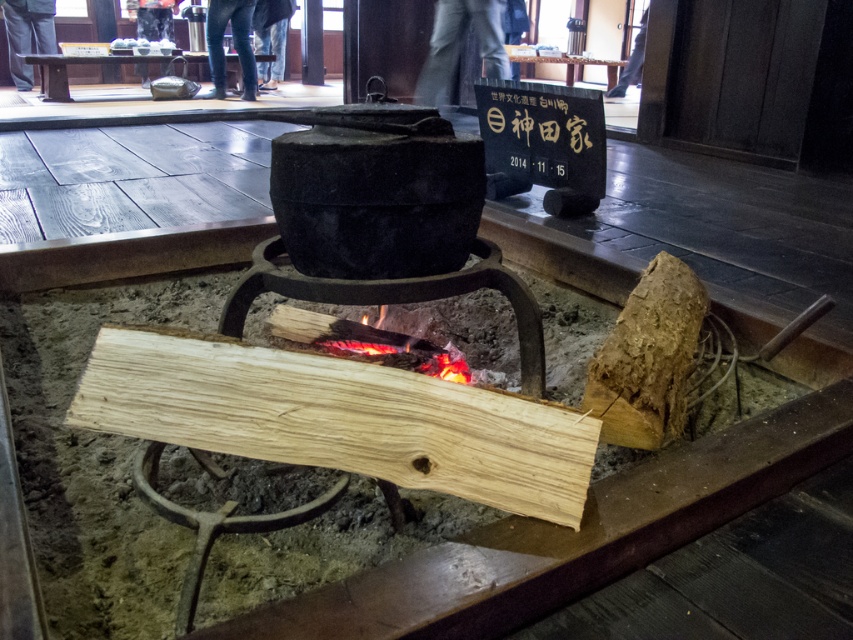
You are standing in front of a traditional Japanese fire pit. You see the light brown wood at center and the charcoal fire at center. Which object is nearer to you?

The light brown wood at center is closer to the viewer than the charcoal fire at center.

You are a visitor at a cultural exhibit and notice the light brown wood at center and the charcoal fire at center. Which object is positioned lower in the scene?

The light brown wood at center is located below the charcoal fire at center, so it is positioned lower in the scene.